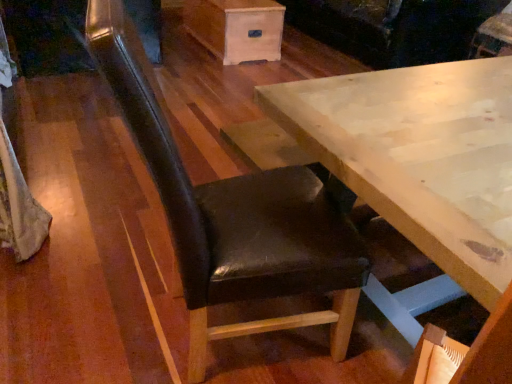
Question: Considering the relative sizes of velvet dark brown couch at upper center and wooden drawer at upper center in the image provided, is velvet dark brown couch at upper center shorter than wooden drawer at upper center?

Choices:
 (A) yes
 (B) no

Answer: (B)

Question: Does velvet dark brown couch at upper center lie behind wooden drawer at upper center?

Choices:
 (A) no
 (B) yes

Answer: (A)

Question: Is velvet dark brown couch at upper center next to wooden drawer at upper center and touching it?

Choices:
 (A) yes
 (B) no

Answer: (B)

Question: Is velvet dark brown couch at upper center outside wooden drawer at upper center?

Choices:
 (A) no
 (B) yes

Answer: (B)

Question: From the image's perspective, is velvet dark brown couch at upper center beneath wooden drawer at upper center?

Choices:
 (A) yes
 (B) no

Answer: (B)

Question: From the image's perspective, is black leather chair at center located above or below wooden drawer at upper center?

Choices:
 (A) above
 (B) below

Answer: (B)

Question: Looking at the image, does black leather chair at center seem bigger or smaller compared to wooden drawer at upper center?

Choices:
 (A) big
 (B) small

Answer: (A)

Question: From their relative heights in the image, would you say black leather chair at center is taller or shorter than wooden drawer at upper center?

Choices:
 (A) tall
 (B) short

Answer: (A)

Question: From a real-world perspective, is black leather chair at center positioned above or below wooden drawer at upper center?

Choices:
 (A) below
 (B) above

Answer: (B)

Question: Is light wood table at center taller or shorter than velvet dark brown couch at upper center?

Choices:
 (A) tall
 (B) short

Answer: (A)

Question: In terms of width, does light wood table at center look wider or thinner when compared to velvet dark brown couch at upper center?

Choices:
 (A) thin
 (B) wide

Answer: (A)

Question: Visually, is light wood table at center positioned to the left or to the right of velvet dark brown couch at upper center?

Choices:
 (A) left
 (B) right

Answer: (A)

Question: From a real-world perspective, is light wood table at center positioned above or below velvet dark brown couch at upper center?

Choices:
 (A) above
 (B) below

Answer: (A)

Question: Is point (328, 99) positioned closer to the camera than point (238, 61)?

Choices:
 (A) farther
 (B) closer

Answer: (B)

Question: From their relative heights in the image, would you say light wood table at center is taller or shorter than wooden drawer at upper center?

Choices:
 (A) tall
 (B) short

Answer: (A)